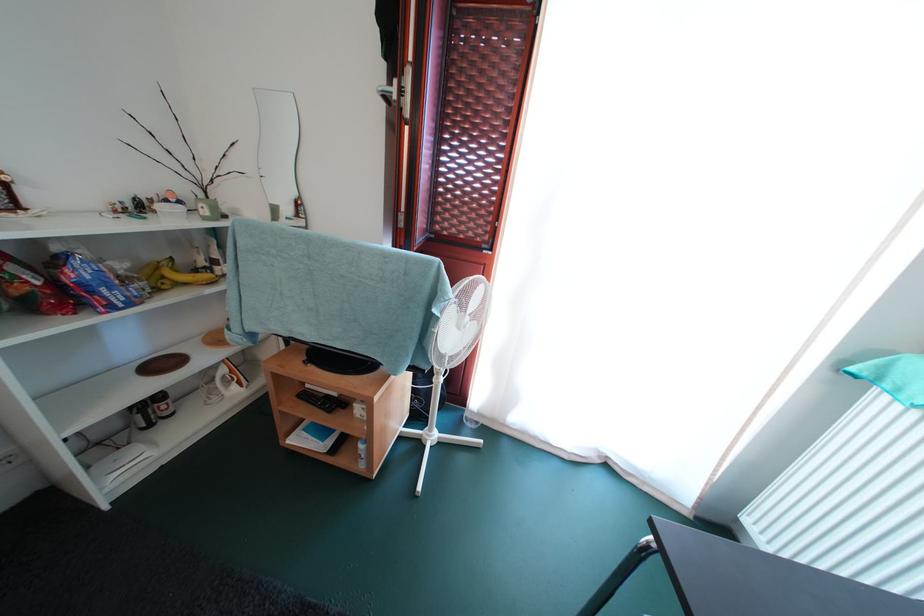
This screenshot has width=924, height=616. What are the coordinates of `silver door handle` in the screenshot? It's located at pos(387,92).